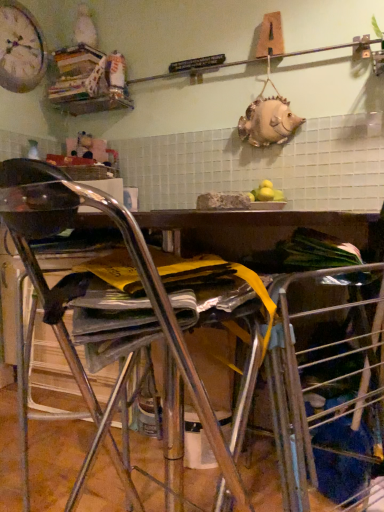
This screenshot has height=512, width=384. What do you see at coordinates (133, 262) in the screenshot? I see `metallic silver chair at center` at bounding box center [133, 262].

Image resolution: width=384 pixels, height=512 pixels. In order to click on matte white clock at upper left in this screenshot , I will do `click(20, 48)`.

This screenshot has height=512, width=384. What do you see at coordinates (89, 81) in the screenshot? I see `wooden bookshelf at upper left` at bounding box center [89, 81].

Locate an element on the screen. The height and width of the screenshot is (512, 384). metallic silver chair at center is located at coordinates (133, 262).

Who is bigger, wooden bookshelf at upper left or metallic silver chair at center?

With larger size is metallic silver chair at center.

Would you say metallic silver chair at center is part of wooden bookshelf at upper left's contents?

No, metallic silver chair at center is not inside wooden bookshelf at upper left.

From the image's perspective, which one is positioned lower, wooden bookshelf at upper left or metallic silver chair at center?

metallic silver chair at center.

Is the position of metallic silver chair at center less distant than that of wooden bookshelf at upper left?

Yes, the depth of metallic silver chair at center is less than that of wooden bookshelf at upper left.

Based on the photo, would you consider metallic silver chair at center to be distant from wooden bookshelf at upper left?

Yes.

In the image, there is a metallic silver chair at center. Where is `shelf above it (from the image's perspective)`? The height and width of the screenshot is (512, 384). shelf above it (from the image's perspective) is located at coordinates (89, 81).

Considering the relative sizes of metallic silver chair at center and matte white clock at upper left in the image provided, is metallic silver chair at center thinner than matte white clock at upper left?

Incorrect, the width of metallic silver chair at center is not less than that of matte white clock at upper left.

Does point (54, 214) come in front of point (23, 46)?

Yes, it is.

Looking at this image, is metallic silver chair at center turned away from matte white clock at upper left?

metallic silver chair at center is not turned away from matte white clock at upper left.

Is matte white clock at upper left inside metallic silver chair at center?

No, matte white clock at upper left is not inside metallic silver chair at center.

From a real-world perspective, is matte white clock at upper left physically below metallic silver chair at center?

Actually, matte white clock at upper left is physically above metallic silver chair at center in the real world.

Is matte white clock at upper left spatially inside metallic silver chair at center, or outside of it?

matte white clock at upper left cannot be found inside metallic silver chair at center.

Is matte white clock at upper left smaller than metallic silver chair at center?

Yes.

Based on the photo, could you tell me if matte white clock at upper left is facing metallic silver chair at center?

No, matte white clock at upper left is not facing towards metallic silver chair at center.

Is wooden bookshelf at upper left behind matte white clock at upper left?

Yes, wooden bookshelf at upper left is further from the camera.

Does wooden bookshelf at upper left touch matte white clock at upper left?

There is a gap between wooden bookshelf at upper left and matte white clock at upper left.

Could matte white clock at upper left be considered to be inside wooden bookshelf at upper left?

Definitely not — matte white clock at upper left is not inside wooden bookshelf at upper left.

How many degrees apart are the facing directions of wooden bookshelf at upper left and matte white clock at upper left?

The angular difference between wooden bookshelf at upper left and matte white clock at upper left is 89.9 degrees.

Could wooden bookshelf at upper left be considered to be inside matte white clock at upper left?

No, wooden bookshelf at upper left is not surrounded by matte white clock at upper left.

Is point (2, 35) more distant than point (55, 92)?

No, it is in front of (55, 92).

Does matte white clock at upper left turn towards wooden bookshelf at upper left?

No, matte white clock at upper left does not turn towards wooden bookshelf at upper left.

Between matte white clock at upper left and wooden bookshelf at upper left, which one is positioned in front?

Positioned in front is matte white clock at upper left.

The image size is (384, 512). I want to click on chair in front of the wooden bookshelf at upper left, so click(133, 262).

At what (x,y) coordinates should I click in order to perform the action: click on shelf lying behind the metallic silver chair at center. Please return your answer as a coordinate pair (x, y). This screenshot has width=384, height=512. Looking at the image, I should click on (89, 81).

Looking at the image, which one is located further to wooden bookshelf at upper left, metallic silver chair at center or matte white clock at upper left?

Based on the image, metallic silver chair at center appears to be further to wooden bookshelf at upper left.

Looking at the image, which one is located closer to metallic silver chair at center, wooden bookshelf at upper left or matte white clock at upper left?

wooden bookshelf at upper left is positioned closer to the anchor metallic silver chair at center.

When comparing their distances from metallic silver chair at center, does matte white clock at upper left or wooden bookshelf at upper left seem further?

matte white clock at upper left is positioned further to the anchor metallic silver chair at center.

Which object lies further to the anchor point matte white clock at upper left, wooden bookshelf at upper left or metallic silver chair at center?

metallic silver chair at center is further to matte white clock at upper left.

Estimate the real-world distances between objects in this image. Which object is closer to wooden bookshelf at upper left, matte white clock at upper left or metallic silver chair at center?

matte white clock at upper left lies closer to wooden bookshelf at upper left than the other object.

Looking at the image, which one is located closer to matte white clock at upper left, metallic silver chair at center or wooden bookshelf at upper left?

wooden bookshelf at upper left lies closer to matte white clock at upper left than the other object.

Locate an element on the screen. The height and width of the screenshot is (512, 384). clock between metallic silver chair at center and wooden bookshelf at upper left from front to back is located at coordinates (20, 48).